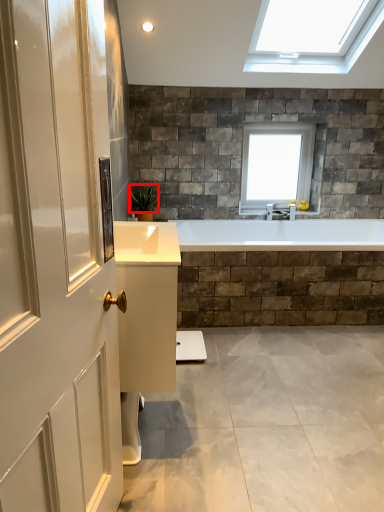
Question: Where is plant (annotated by the red box) located in relation to window in the image?

Choices:
 (A) left
 (B) right

Answer: (A)